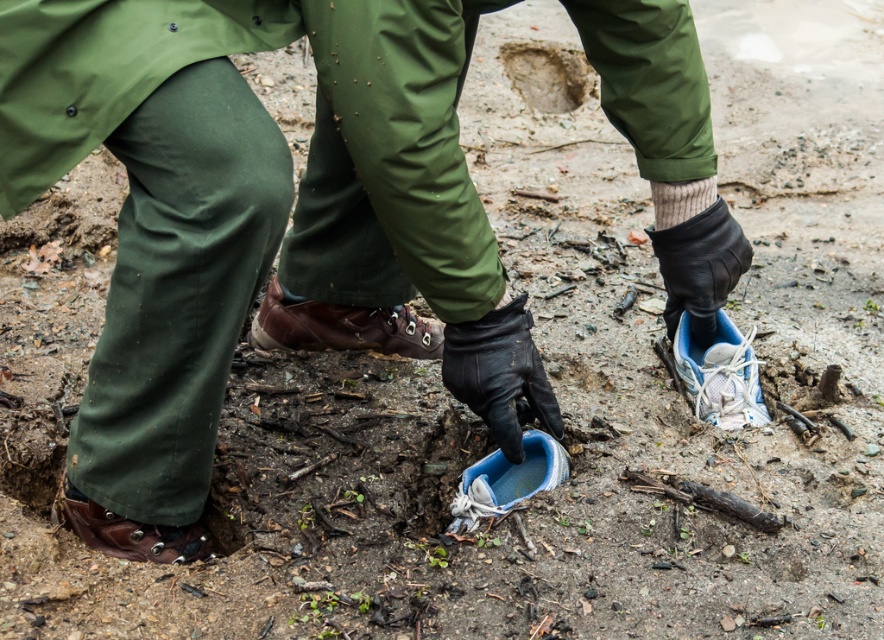
Between point (496, 330) and point (555, 92), which one is positioned in front?

Point (496, 330)

Between black leather boot at center and brown dirt hole at center, which one is positioned higher?

brown dirt hole at center is above.

You are a GUI agent. You are given a task and a screenshot of the screen. Output one action in this format:
    pyautogui.click(x=<x>, y=<y>)
    Task: Click on the black leather boot at center
    
    Given the screenshot: What is the action you would take?
    pyautogui.click(x=500, y=374)

Is brown leather shoe at center positioned before brown leather shoe at lower left?

No, brown leather shoe at center is behind brown leather shoe at lower left.

Is brown leather shoe at center wider than brown leather shoe at lower left?

Yes.

The height and width of the screenshot is (640, 884). What do you see at coordinates (341, 326) in the screenshot?
I see `brown leather shoe at center` at bounding box center [341, 326].

Identify the location of brown leather shoe at center. (341, 326).

Does point (453, 337) come behind point (677, 204)?

No, (453, 337) is closer to viewer.

Can you confirm if black leather boot at center is positioned below white knitted sock at lower right?

Correct, black leather boot at center is located below white knitted sock at lower right.

Who is more distant from viewer, (458,369) or (656,195)?

The point (656,195) is more distant.

This screenshot has width=884, height=640. In order to click on black leather boot at center in this screenshot , I will do `click(500, 374)`.